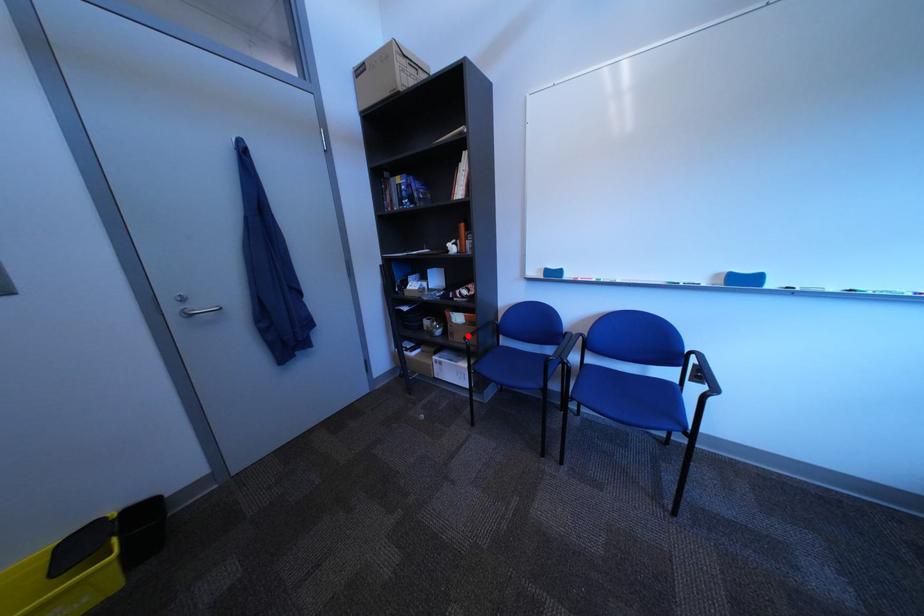
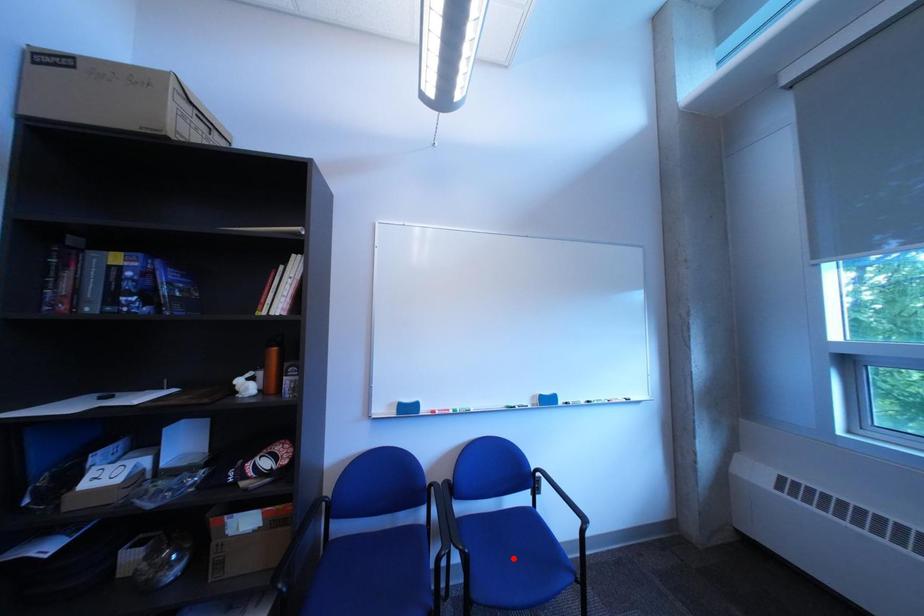
I am providing you with two images of the same scene from different viewpoints. A red point is marked on the first image and another point is marked on the second image. Are the points marked in image1 and image2 representing the same 3D position?

No